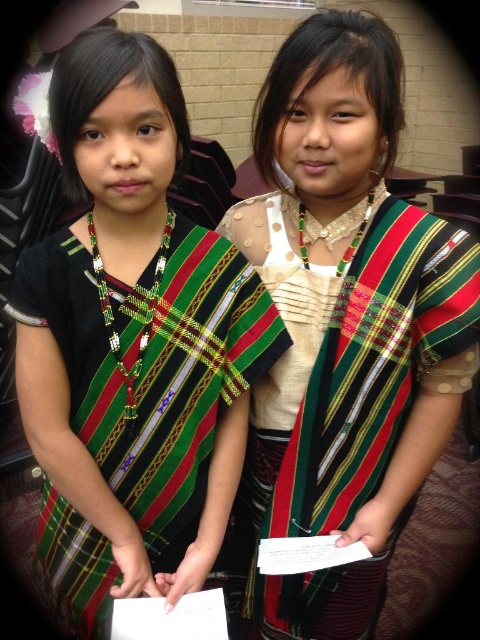
You are a photographer setting up a camera at the event. You want to ensure both the matte black dress at left and the textured woven dress at center are fully visible in the frame. Which dress should you adjust the camera angle to focus on first to ensure proper framing?

The matte black dress at left is not as tall as the textured woven dress at center. Therefore, you should focus on the textured woven dress at center first to ensure its full height is captured, then adjust for the shorter matte black dress at left.